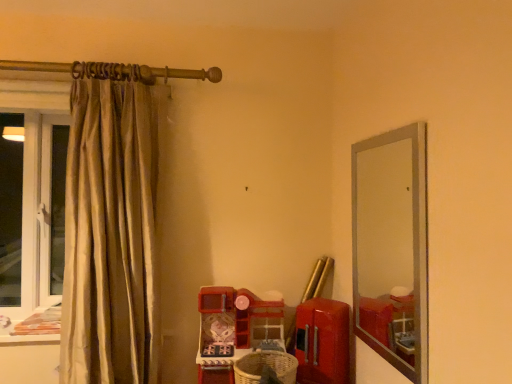
Question: Should I look upward or downward to see woven brown basket at lower center?

Choices:
 (A) up
 (B) down

Answer: (B)

Question: Could you tell me if silky beige curtain at left is turned towards clear glass mirror at right?

Choices:
 (A) no
 (B) yes

Answer: (A)

Question: From the image's perspective, would you say silky beige curtain at left is shown under clear glass mirror at right?

Choices:
 (A) no
 (B) yes

Answer: (A)

Question: From a real-world perspective, is silky beige curtain at left below clear glass mirror at right?

Choices:
 (A) yes
 (B) no

Answer: (B)

Question: Does silky beige curtain at left have a greater width compared to clear glass mirror at right?

Choices:
 (A) yes
 (B) no

Answer: (A)

Question: From the image's perspective, would you say silky beige curtain at left is positioned over clear glass mirror at right?

Choices:
 (A) yes
 (B) no

Answer: (A)

Question: Can you confirm if silky beige curtain at left is shorter than clear glass mirror at right?

Choices:
 (A) no
 (B) yes

Answer: (A)

Question: Considering the relative sizes of clear glass mirror at right and silky beige curtain at left in the image provided, is clear glass mirror at right smaller than silky beige curtain at left?

Choices:
 (A) no
 (B) yes

Answer: (B)

Question: From a real-world perspective, is clear glass mirror at right under silky beige curtain at left?

Choices:
 (A) no
 (B) yes

Answer: (B)

Question: Is clear glass mirror at right at the right side of silky beige curtain at left?

Choices:
 (A) no
 (B) yes

Answer: (B)

Question: Could you tell me if clear glass mirror at right is turned towards silky beige curtain at left?

Choices:
 (A) yes
 (B) no

Answer: (A)

Question: Is clear glass mirror at right outside silky beige curtain at left?

Choices:
 (A) no
 (B) yes

Answer: (B)

Question: Considering the relative sizes of clear glass mirror at right and silky beige curtain at left in the image provided, is clear glass mirror at right shorter than silky beige curtain at left?

Choices:
 (A) no
 (B) yes

Answer: (B)

Question: Can you confirm if woven brown basket at lower center is smaller than silky beige curtain at left?

Choices:
 (A) yes
 (B) no

Answer: (A)